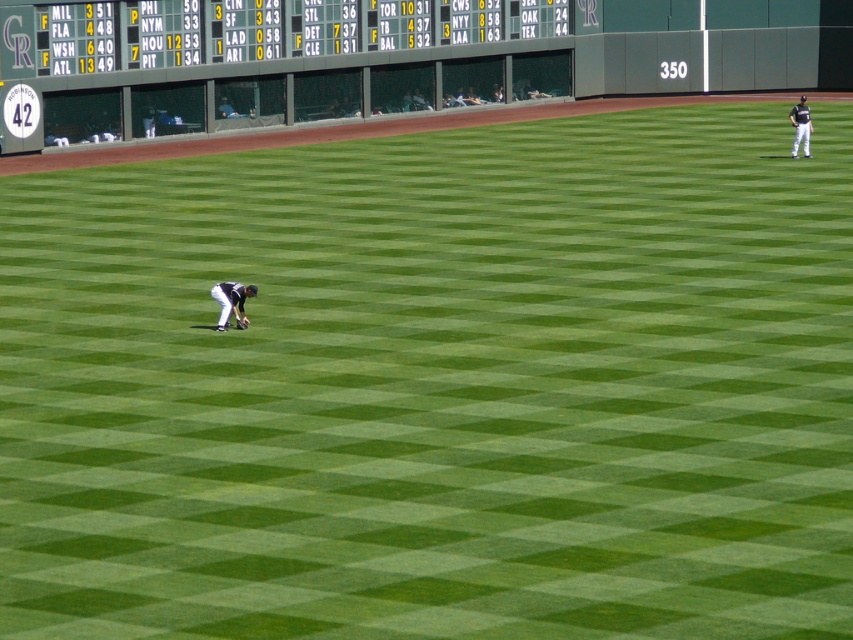
Between white plastic scoreboard at upper center and white uniform at right, which one appears on the right side from the viewer's perspective?

white uniform at right is more to the right.

Who is more forward, (173, 17) or (805, 122)?

Positioned in front is point (805, 122).

The height and width of the screenshot is (640, 853). Find the location of `white plastic scoreboard at upper center`. white plastic scoreboard at upper center is located at coordinates point(253,29).

Between point (231, 308) and point (808, 128), which one is positioned behind?

Positioned behind is point (808, 128).

Consider the image. Is black uniform at lower left taller than white uniform at right?

Incorrect, black uniform at lower left's height is not larger of white uniform at right's.

This screenshot has width=853, height=640. What do you see at coordinates (231, 301) in the screenshot?
I see `black uniform at lower left` at bounding box center [231, 301].

Where is `black uniform at lower left`? Image resolution: width=853 pixels, height=640 pixels. black uniform at lower left is located at coordinates (231, 301).

Who is shorter, white plastic scoreboard at upper center or dark brown leather glove at center?

dark brown leather glove at center is shorter.

Find the location of a particular element. The width and height of the screenshot is (853, 640). white plastic scoreboard at upper center is located at coordinates (253, 29).